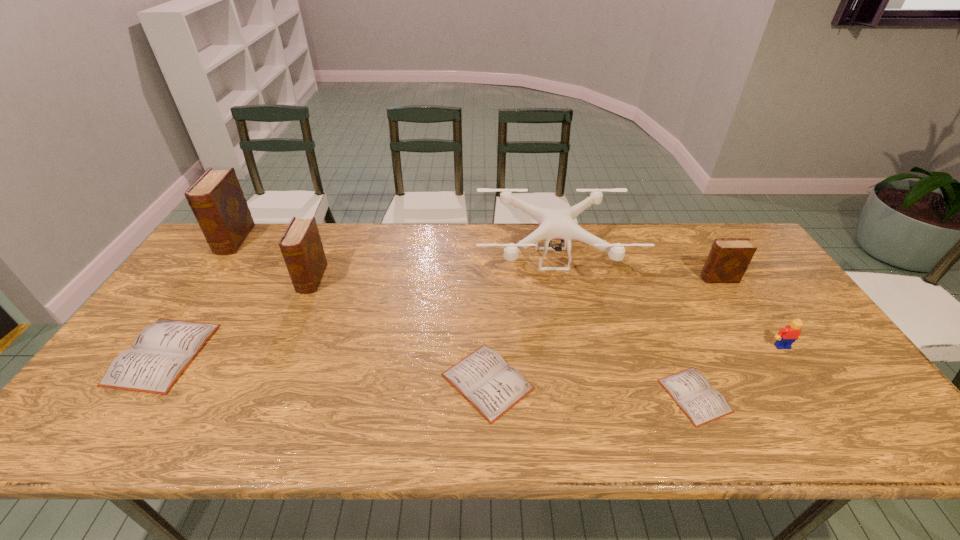
Identify the location of vacant area at the right edge. (769, 343).

At what (x,y) coordinates should I click in order to perform the action: click on free space at the far left corner. Please return your answer as a coordinate pair (x, y). The image size is (960, 540). Looking at the image, I should click on (241, 262).

Find the location of a particular element. free region at the near left corner of the desktop is located at coordinates (84, 428).

Locate an element on the screen. blank region between the tallest diary and the leftmost white diary is located at coordinates (199, 297).

Identify the location of empty space between the sixth tallest object and the Lego. This screenshot has height=540, width=960. (472, 350).

Find the location of a particular element. This screenshot has height=540, width=960. vacant area between the smallest white diary and the fourth diary from left to right is located at coordinates (591, 389).

Where is `free space between the shortest diary and the second white diary from right to left`? This screenshot has width=960, height=540. free space between the shortest diary and the second white diary from right to left is located at coordinates (591, 389).

At what (x,y) coordinates should I click in order to perform the action: click on vacant space that's between the second shortest diary and the biggest brown diary. Please return your answer as a coordinate pair (x, y). This screenshot has height=540, width=960. Looking at the image, I should click on (361, 310).

Find the location of `empty location between the fifth shortest object and the sixth tallest object`. empty location between the fifth shortest object and the sixth tallest object is located at coordinates (441, 316).

This screenshot has width=960, height=540. In order to click on free space between the rightmost diary and the fifth tallest diary in this screenshot , I will do `click(603, 330)`.